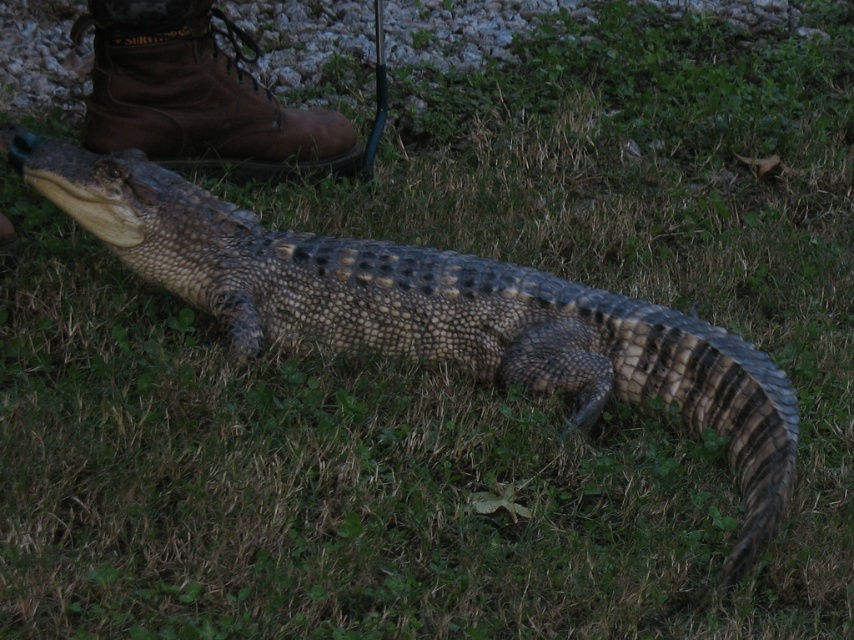
You are standing in the scene and want to pick up an object. Which of the two points, point [393,353] or point [191,58], is closer to you?

Point [393,353] is closer to the viewer than point [191,58], so you should pick up the one at point [393,353] first.

You are a photographer trying to capture a closeup of the scaly brown crocodile at center without moving the brown leather boot at upper left. Can you get a clear shot of the crocodile without the boot blocking the view?

The scaly brown crocodile at center is positioned under the brown leather boot at upper left, so the boot will block the view of the crocodile. You cannot get a clear shot without moving the boot.